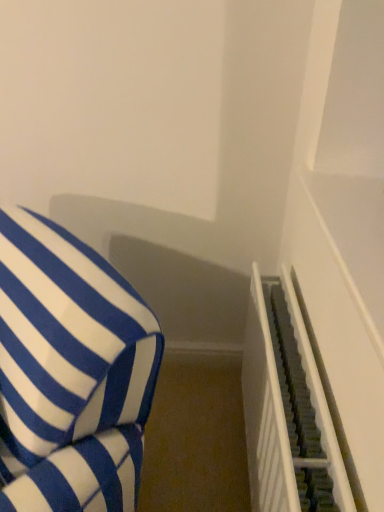
The width and height of the screenshot is (384, 512). Describe the element at coordinates (70, 372) in the screenshot. I see `blue and white striped cushion at left` at that location.

You are a GUI agent. You are given a task and a screenshot of the screen. Output one action in this format:
    pyautogui.click(x=<x>, y=<y>)
    Task: Click on the blue and white striped cushion at left
    
    Given the screenshot: What is the action you would take?
    pyautogui.click(x=70, y=372)

Looking at this image, what is the approximate width of dark gray textured stairwell at right?

13.82 centimeters.

What do you see at coordinates (287, 410) in the screenshot?
I see `dark gray textured stairwell at right` at bounding box center [287, 410].

Identify the location of dark gray textured stairwell at right. This screenshot has height=512, width=384. (287, 410).

Where is `blue and white striped cushion at left`? blue and white striped cushion at left is located at coordinates (70, 372).

Is blue and white striped cushion at left to the left or to the right of dark gray textured stairwell at right in the image?

blue and white striped cushion at left is positioned on dark gray textured stairwell at right's left side.

Between blue and white striped cushion at left and dark gray textured stairwell at right, which one is positioned behind?

dark gray textured stairwell at right is more distant.

Which is nearer, (104,365) or (293,387)?

Point (104,365)

From the image's perspective, relative to dark gray textured stairwell at right, is blue and white striped cushion at left above or below?

From the image's perspective, blue and white striped cushion at left appears above dark gray textured stairwell at right.

From a real-world perspective, is blue and white striped cushion at left beneath dark gray textured stairwell at right?

No, from a real-world perspective, blue and white striped cushion at left is not under dark gray textured stairwell at right.

Is blue and white striped cushion at left wider or thinner than dark gray textured stairwell at right?

Clearly, blue and white striped cushion at left has more width compared to dark gray textured stairwell at right.

Consider the image. Is blue and white striped cushion at left taller than dark gray textured stairwell at right?

Correct, blue and white striped cushion at left is much taller as dark gray textured stairwell at right.

Consider the image. Looking at the image, does blue and white striped cushion at left seem bigger or smaller compared to dark gray textured stairwell at right?

Clearly, blue and white striped cushion at left is larger in size than dark gray textured stairwell at right.

Would you say blue and white striped cushion at left is outside dark gray textured stairwell at right?

Yes, blue and white striped cushion at left is outside of dark gray textured stairwell at right.

Would you say blue and white striped cushion at left is a long distance from dark gray textured stairwell at right?

No, there isn't a large distance between blue and white striped cushion at left and dark gray textured stairwell at right.

Consider the image. Is blue and white striped cushion at left facing towards dark gray textured stairwell at right?

No, blue and white striped cushion at left is not turned towards dark gray textured stairwell at right.

Where is `furniture on the left side of dark gray textured stairwell at right`? Image resolution: width=384 pixels, height=512 pixels. furniture on the left side of dark gray textured stairwell at right is located at coordinates (70, 372).

Considering the relative positions of dark gray textured stairwell at right and blue and white striped cushion at left in the image provided, is dark gray textured stairwell at right to the right of blue and white striped cushion at left from the viewer's perspective?

Yes, dark gray textured stairwell at right is to the right of blue and white striped cushion at left.

Does dark gray textured stairwell at right come behind blue and white striped cushion at left?

Yes, dark gray textured stairwell at right is further from the viewer.

Which is closer, (333, 463) or (99, 331)?

The point (333, 463) is in front.

From the image's perspective, which is below, dark gray textured stairwell at right or blue and white striped cushion at left?

From the image's view, dark gray textured stairwell at right is below.

From a real-world perspective, who is located lower, dark gray textured stairwell at right or blue and white striped cushion at left?

dark gray textured stairwell at right.

In terms of width, does dark gray textured stairwell at right look wider or thinner when compared to blue and white striped cushion at left?

Considering their sizes, dark gray textured stairwell at right looks slimmer than blue and white striped cushion at left.

Which of these two, dark gray textured stairwell at right or blue and white striped cushion at left, stands taller?

With more height is blue and white striped cushion at left.

Considering the sizes of dark gray textured stairwell at right and blue and white striped cushion at left in the image, is dark gray textured stairwell at right bigger or smaller than blue and white striped cushion at left?

In the image, dark gray textured stairwell at right appears to be smaller than blue and white striped cushion at left.

Would you say dark gray textured stairwell at right is outside blue and white striped cushion at left?

Absolutely, dark gray textured stairwell at right is external to blue and white striped cushion at left.

Is dark gray textured stairwell at right directly adjacent to blue and white striped cushion at left?

dark gray textured stairwell at right and blue and white striped cushion at left are clearly separated.

Could you tell me if dark gray textured stairwell at right is turned towards blue and white striped cushion at left?

Yes, dark gray textured stairwell at right is oriented towards blue and white striped cushion at left.

How many degrees apart are the facing directions of dark gray textured stairwell at right and blue and white striped cushion at left?

There is a 42.2-degree angle between the facing directions of dark gray textured stairwell at right and blue and white striped cushion at left.

Locate an element on the screen. The width and height of the screenshot is (384, 512). stairwell that appears on the right of blue and white striped cushion at left is located at coordinates (287, 410).

Find the location of a particular element. The image size is (384, 512). furniture in front of the dark gray textured stairwell at right is located at coordinates (70, 372).

The width and height of the screenshot is (384, 512). Identify the location of furniture lying above the dark gray textured stairwell at right (from the image's perspective). (70, 372).